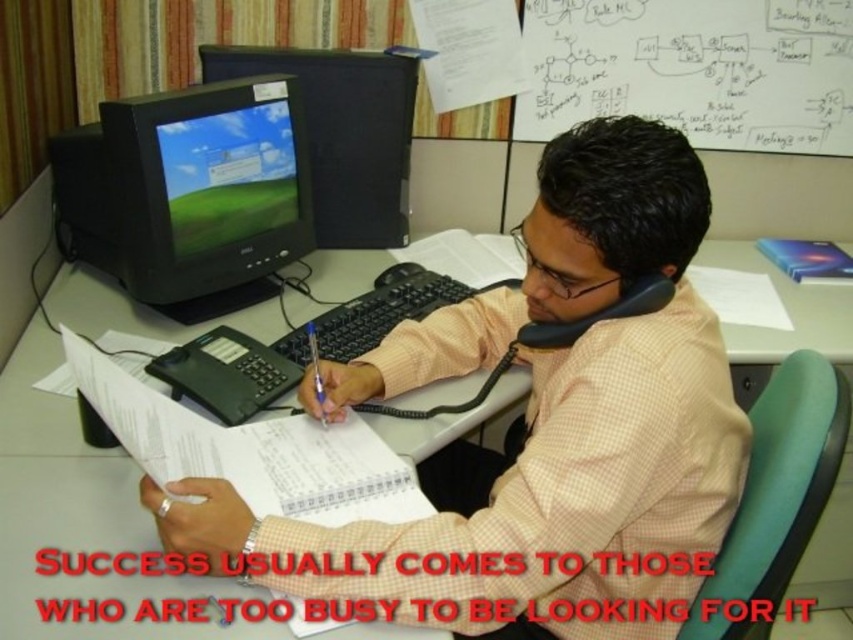
Can you confirm if matte black monitor at center is positioned above white paper at lower center?

Correct, matte black monitor at center is located above white paper at lower center.

What do you see at coordinates (343, 132) in the screenshot? I see `matte black monitor at center` at bounding box center [343, 132].

This screenshot has height=640, width=853. I want to click on matte black monitor at center, so click(343, 132).

Does black matte monitor at upper left have a lesser height compared to blue plastic pen at center?

No.

Does black matte monitor at upper left have a lesser width compared to blue plastic pen at center?

No.

Is point (144, 196) farther from camera compared to point (312, 332)?

That is False.

Identify the location of black matte monitor at upper left. (189, 193).

Can you confirm if pink checkered shirt at center is taller than white paper at lower center?

Yes.

Looking at this image, can you confirm if pink checkered shirt at center is bigger than white paper at lower center?

Yes, pink checkered shirt at center is bigger than white paper at lower center.

Image resolution: width=853 pixels, height=640 pixels. I want to click on pink checkered shirt at center, so click(x=538, y=428).

The image size is (853, 640). Find the location of `pink checkered shirt at center`. pink checkered shirt at center is located at coordinates (538, 428).